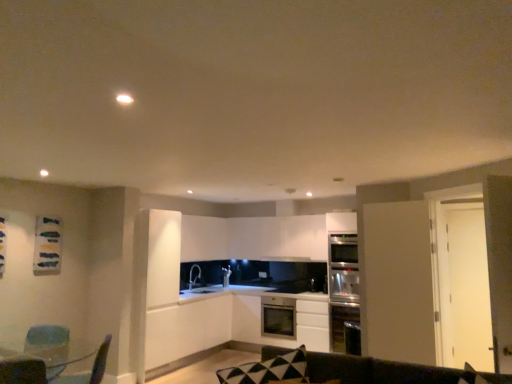
Question: Does dark brown leather couch at lower center have a lesser width compared to green fabric swivel chair at lower left, the first swivel chair in the left-to-right sequence?

Choices:
 (A) yes
 (B) no

Answer: (B)

Question: From the image's perspective, is dark brown leather couch at lower center located beneath green fabric swivel chair at lower left, the first swivel chair in the left-to-right sequence?

Choices:
 (A) no
 (B) yes

Answer: (A)

Question: Is dark brown leather couch at lower center smaller than green fabric swivel chair at lower left, the first swivel chair in the left-to-right sequence?

Choices:
 (A) yes
 (B) no

Answer: (B)

Question: Is dark brown leather couch at lower center at the right side of green fabric swivel chair at lower left, arranged as the 2th swivel chair when viewed from the right?

Choices:
 (A) yes
 (B) no

Answer: (A)

Question: Is green fabric swivel chair at lower left, the first swivel chair in the left-to-right sequence, surrounded by dark brown leather couch at lower center?

Choices:
 (A) yes
 (B) no

Answer: (B)

Question: From the image's perspective, is metallic blue swivel chair at lower left, which is the first swivel chair in right-to-left order, positioned above or below matte glass table at lower left?

Choices:
 (A) below
 (B) above

Answer: (B)

Question: From a real-world perspective, is metallic blue swivel chair at lower left, which is the first swivel chair in right-to-left order, physically located above or below matte glass table at lower left?

Choices:
 (A) above
 (B) below

Answer: (A)

Question: Looking at their shapes, would you say metallic blue swivel chair at lower left, the second swivel chair when ordered from left to right, is wider or thinner than matte glass table at lower left?

Choices:
 (A) wide
 (B) thin

Answer: (B)

Question: Is point (84, 375) positioned closer to the camera than point (14, 347)?

Choices:
 (A) closer
 (B) farther

Answer: (A)

Question: In terms of width, does stainless steel oven at center, the 3th cabinetry viewed from the top, look wider or thinner when compared to metallic blue swivel chair at lower left, which is the first swivel chair in right-to-left order?

Choices:
 (A) thin
 (B) wide

Answer: (B)

Question: Considering their positions, is stainless steel oven at center, the 3th cabinetry viewed from the top, located in front of or behind metallic blue swivel chair at lower left, which is the first swivel chair in right-to-left order?

Choices:
 (A) front
 (B) behind

Answer: (B)

Question: Is stainless steel oven at center, which is the first cabinetry in bottom-to-top order, inside the boundaries of metallic blue swivel chair at lower left, the second swivel chair when ordered from left to right, or outside?

Choices:
 (A) outside
 (B) inside

Answer: (A)

Question: Is point (324, 309) closer or farther from the camera than point (96, 370)?

Choices:
 (A) closer
 (B) farther

Answer: (B)

Question: Considering the positions of point (278, 336) and point (61, 337), is point (278, 336) closer or farther from the camera than point (61, 337)?

Choices:
 (A) farther
 (B) closer

Answer: (A)

Question: Is stainless steel oven at center, the 3th cabinetry viewed from the top, situated inside green fabric swivel chair at lower left, arranged as the 2th swivel chair when viewed from the right, or outside?

Choices:
 (A) inside
 (B) outside

Answer: (B)